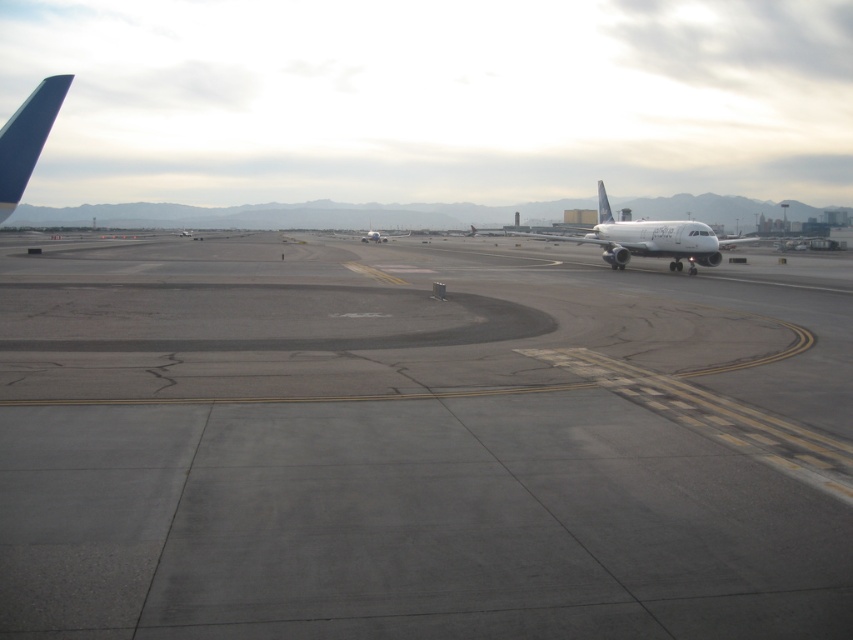
Looking at this image, you are a pilot preparing for takeoff and notice the gray asphalt runway at center and the white glossy airplane at center. Which object is closer to your current position?

The gray asphalt runway at center is closer to your current position because it is in front of the white glossy airplane at center.

Based on the photo, you are a pilot preparing for takeoff and need to check two points on the tarmac. The first point is at coordinate point (297, 408) and the second is at coordinate point (630, 225). Which point is closer to your current position inside the cockpit?

Point (297, 408) is closer to the viewer than point (630, 225), so the first point is closer to your current position inside the cockpit.

Looking at this image, you are a pilot preparing for takeoff and notice the gray asphalt runway at center and the white glossy airplane at center. Which object is positioned lower in the image?

The gray asphalt runway at center is positioned below the white glossy airplane at center, so it is lower in the image.